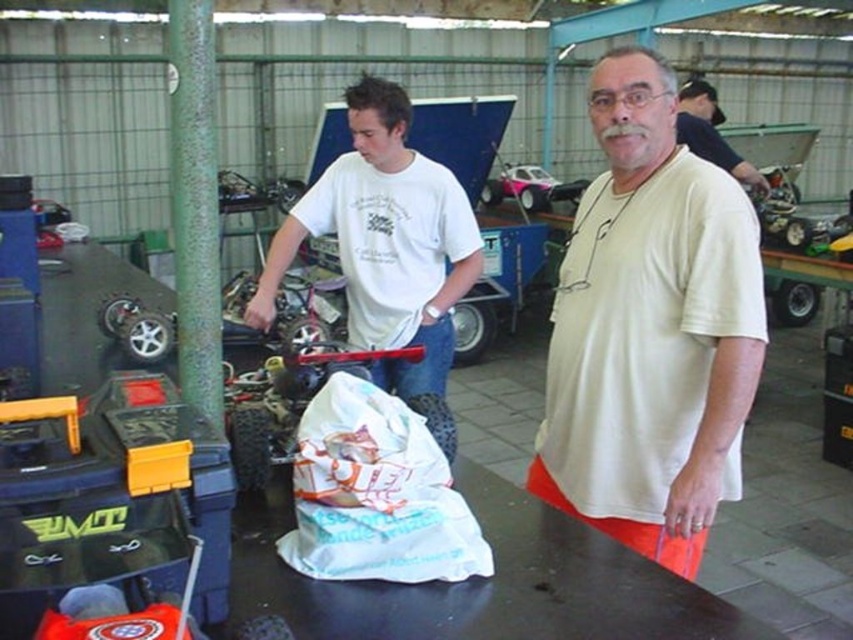
Does white paper bag at center have a smaller size compared to dark blue shirt at upper right?

Yes.

Can you confirm if white paper bag at center is wider than dark blue shirt at upper right?

In fact, white paper bag at center might be narrower than dark blue shirt at upper right.

Does point (369, 541) come closer to viewer compared to point (727, 160)?

Yes, it is.

This screenshot has height=640, width=853. In order to click on white paper bag at center in this screenshot , I will do `click(376, 493)`.

Which of these two, white matte t-shirt at center or white paper bag at center, stands shorter?

white paper bag at center

Where is `white matte t-shirt at center`? white matte t-shirt at center is located at coordinates (650, 330).

Which is below, white matte t-shirt at center or dark blue shirt at upper right?

white matte t-shirt at center is below.

Describe the element at coordinates (650, 330) in the screenshot. I see `white matte t-shirt at center` at that location.

Image resolution: width=853 pixels, height=640 pixels. In order to click on white matte t-shirt at center in this screenshot , I will do 650,330.